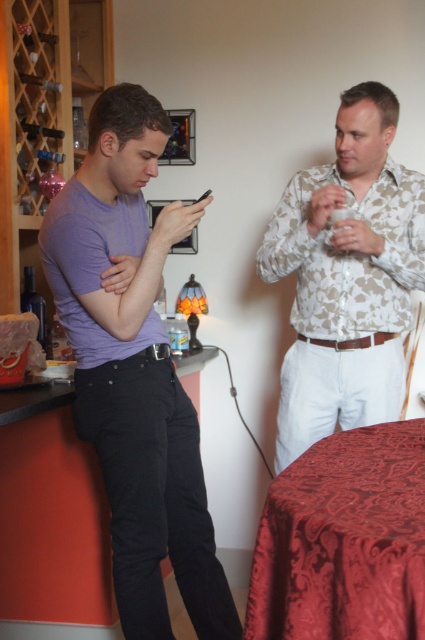
Who is positioned more to the right, purple matte shirt at left or velvet-like red tablecloth at lower right?

velvet-like red tablecloth at lower right is more to the right.

In the scene shown: Who is higher up, purple matte shirt at left or velvet-like red tablecloth at lower right?

purple matte shirt at left is higher up.

Identify the location of purple matte shirt at left. The image size is (425, 640). (135, 369).

Does purple matte shirt at left have a greater width compared to smooth glossy table at lower center?

Yes, purple matte shirt at left is wider than smooth glossy table at lower center.

Describe the element at coordinates (135, 369) in the screenshot. Image resolution: width=425 pixels, height=640 pixels. I see `purple matte shirt at left` at that location.

You are a GUI agent. You are given a task and a screenshot of the screen. Output one action in this format:
    pyautogui.click(x=<x>, y=<y>)
    Task: Click on the purple matte shirt at left
    
    Given the screenshot: What is the action you would take?
    pyautogui.click(x=135, y=369)

Which is in front, point (305, 232) or point (102, 593)?

Positioned in front is point (305, 232).

Can you confirm if white floral shirt at upper center is wider than smooth glossy table at lower center?

Yes, white floral shirt at upper center is wider than smooth glossy table at lower center.

What do you see at coordinates (346, 276) in the screenshot? I see `white floral shirt at upper center` at bounding box center [346, 276].

This screenshot has width=425, height=640. Identify the location of white floral shirt at upper center. (346, 276).